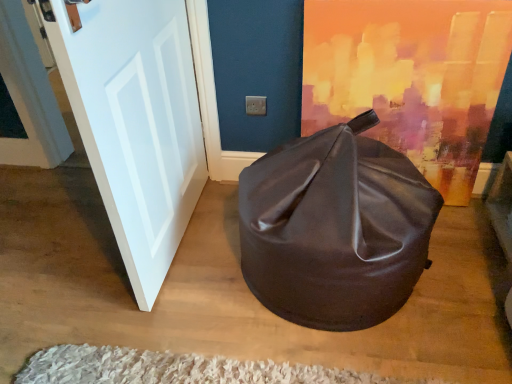
Locate an element on the screen. This screenshot has height=384, width=512. vacant area situated below white glossy door at left (from a real-world perspective) is located at coordinates (179, 246).